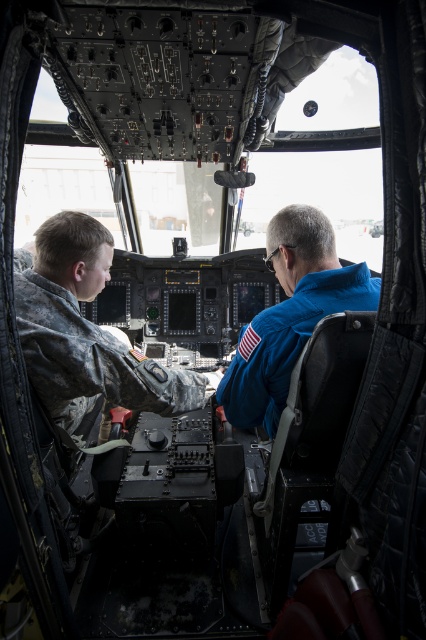
You are inside a cockpit and need to locate the camouflage fabric uniform at left. According to the coordinates provided, where exactly is it positioned in the image?

The camouflage fabric uniform at left is positioned at the 2D coordinates point (88,332) in the image.

You are a maintenance technician standing outside the cockpit. You need to reach the camouflage fabric uniform at left to inspect it. Can you reach it if your arm can extend 1.2 meters?

The camouflage fabric uniform at left is 1.19 meters away from the viewer, so yes, you can reach it with an arm extension of 1.2 meters since it is slightly closer than the maximum reach.